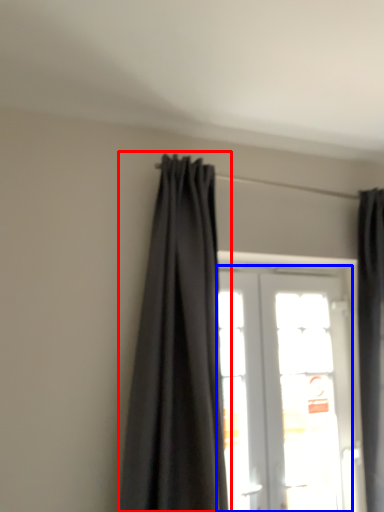
Question: Among these objects, which one is farthest to the camera, curtain (highlighted by a red box) or door (highlighted by a blue box)?

Choices:
 (A) curtain
 (B) door

Answer: (B)